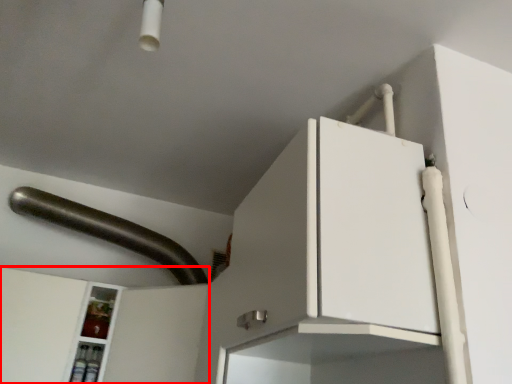
Question: From the image's perspective, what is the correct spatial positioning of cabinetry (annotated by the red box) in reference to door handle?

Choices:
 (A) below
 (B) above

Answer: (A)